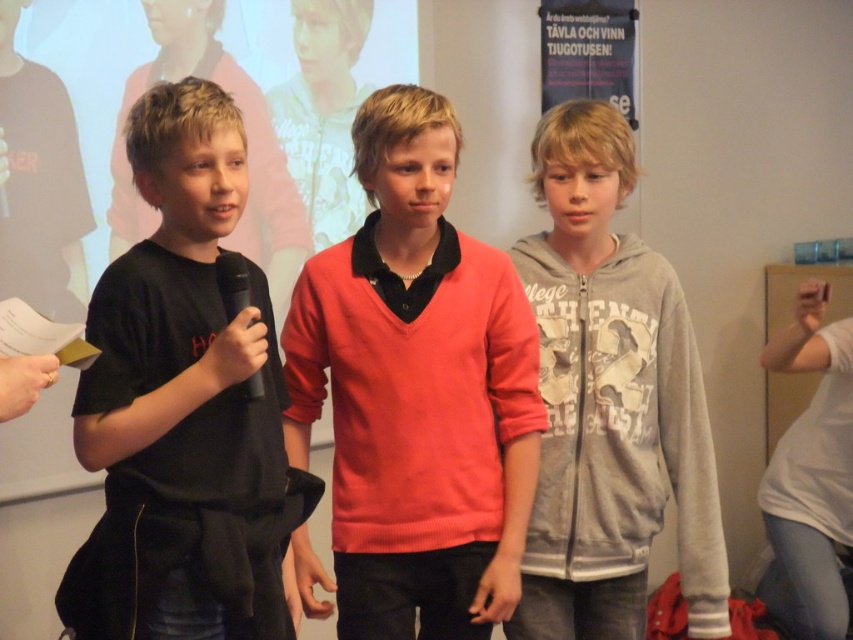
You are a photographer setting up for a school event. You need to arrange two boys in a line so that their clothing sizes are proportional to their positions. The boy wearing the matte coral sweater at center should be positioned where in relation to the black matte shirt at left?

The matte coral sweater at center is larger in size than the black matte shirt at left, so the boy wearing the matte coral sweater at center should be placed further back to maintain proportional sizing based on their positions in the line.

You are a photographer taking a picture of the two boys. The black matte shirt at left is behind the matte coral sweater at center. To ensure both boys are fully visible in the photo, which boy should you move forward slightly?

You should move the black matte shirt at left forward slightly so it is no longer behind the matte coral sweater at center, ensuring both are fully visible.